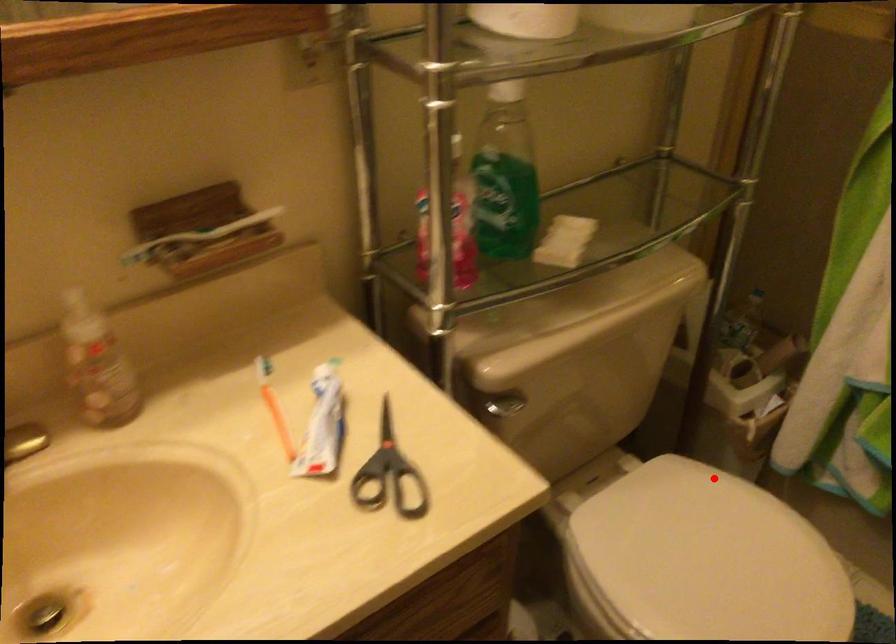
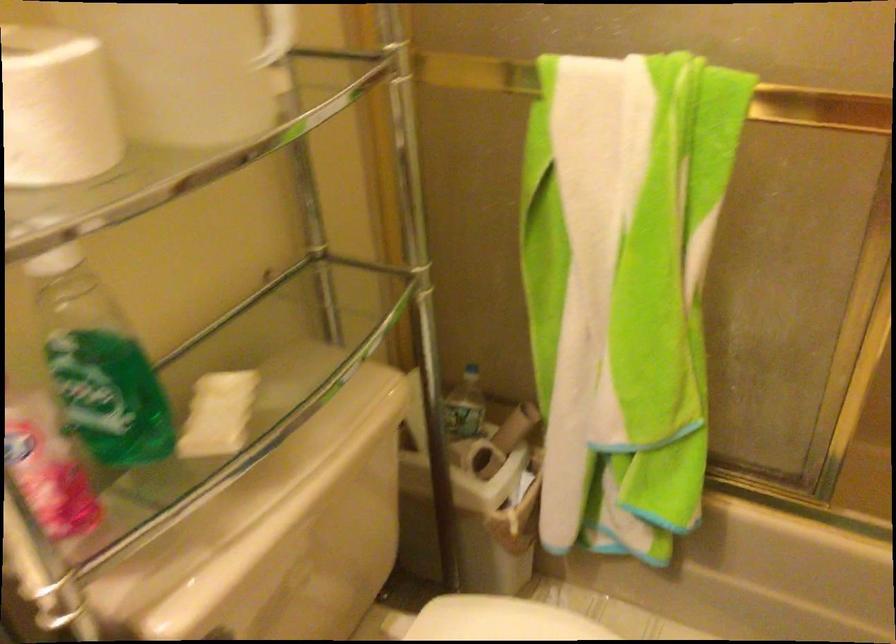
Question: I am providing you with two images of the same scene from different viewpoints. Image1 has a red point marked. In image2, the corresponding 3D location appears at what relative position? Reply with the corresponding letter.

Choices:
 (A) Closer
 (B) Farther

Answer: (A)